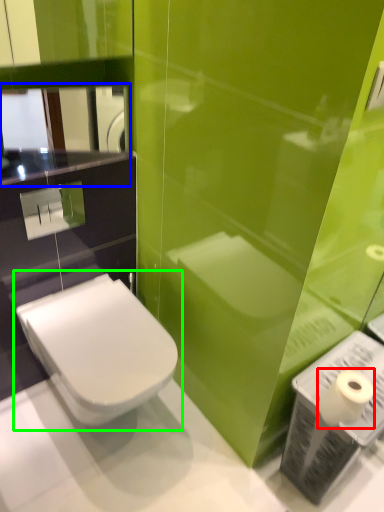
Question: Estimate the real-world distances between objects in this image. Which object is closer to toilet paper (highlighted by a red box), mirror (highlighted by a blue box) or toilet (highlighted by a green box)?

Choices:
 (A) mirror
 (B) toilet

Answer: (B)